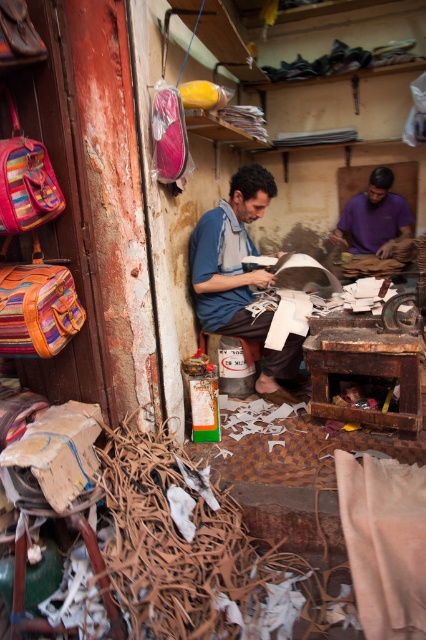
Consider the image. You are organizing a storage area in the workshop and need to stack the striped fabric backpack at left and the purple fabric at center vertically. Which item should you place at the bottom to ensure stability?

The striped fabric backpack at left should be placed at the bottom because it is shorter than the purple fabric at center, providing a stable base for stacking.

You are a delivery person who needs to place a package between the blue fabric shirt at center and the striped fabric backpack at left. The package is 1.5 meters long. Can you fit the package between them without moving either object?

The distance between the blue fabric shirt at center and the striped fabric backpack at left is 1.48 meters. Since the package is 1.5 meters long, it cannot fit between them without moving either object.